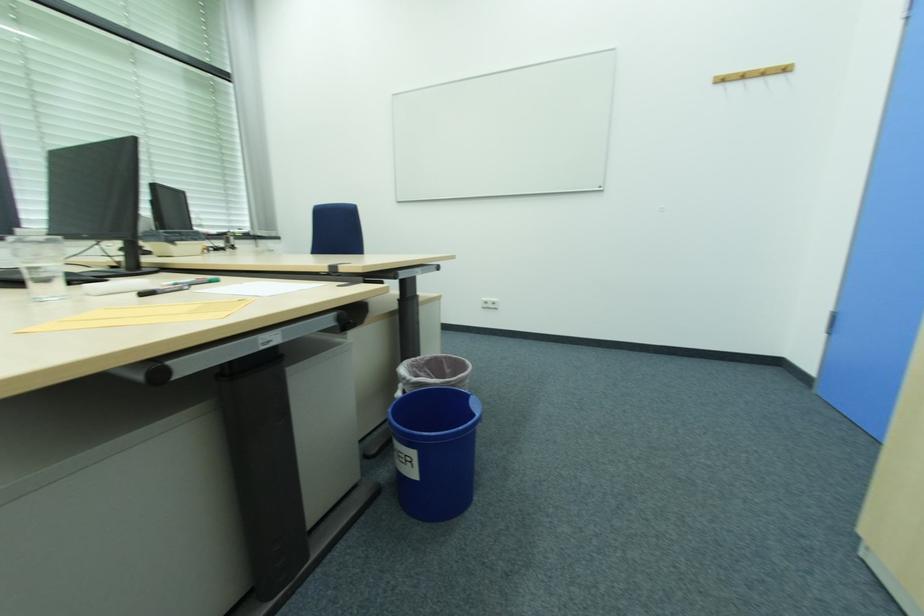
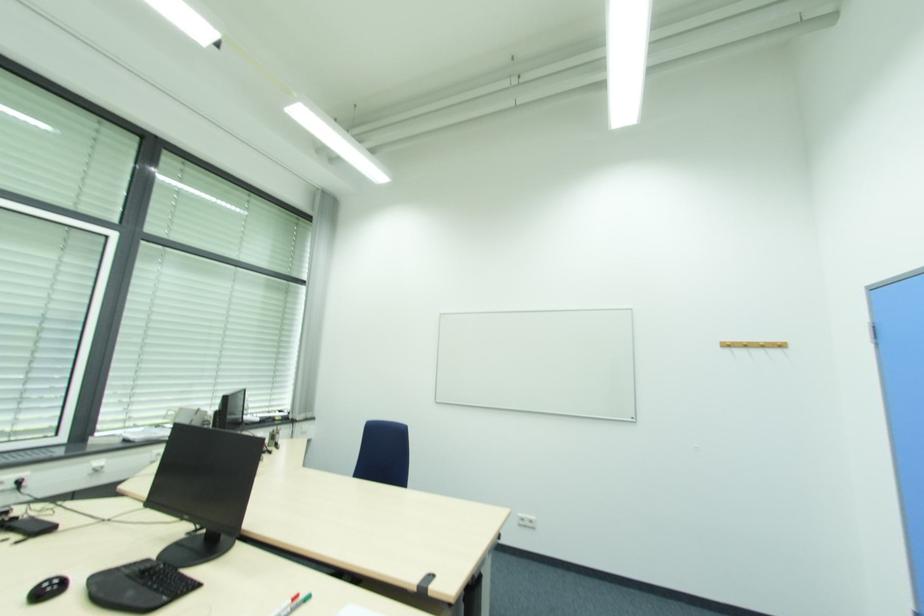
Locate, in the second image, the point that corresponds to point (764, 74) in the first image.

(764, 346)